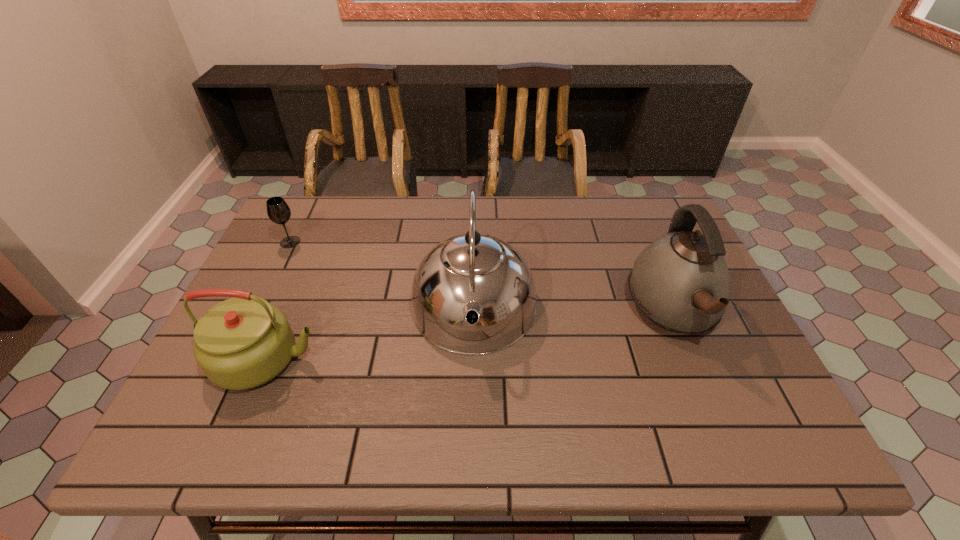
Find the location of a particular element. This screenshot has width=960, height=540. the third object from left to right is located at coordinates (473, 294).

This screenshot has height=540, width=960. In order to click on the rightmost kettle in this screenshot , I will do `click(681, 282)`.

Where is `the second tallest object`? This screenshot has height=540, width=960. the second tallest object is located at coordinates (681, 282).

I want to click on the shortest kettle, so click(x=241, y=343).

What are the coordinates of `the third tallest object` in the screenshot? It's located at (241, 343).

You are a GUI agent. You are given a task and a screenshot of the screen. Output one action in this format:
    pyautogui.click(x=<x>, y=<y>)
    Task: Click on the shortest object
    This screenshot has height=540, width=960.
    Given the screenshot: What is the action you would take?
    pyautogui.click(x=278, y=211)

You are a GUI agent. You are given a task and a screenshot of the screen. Output one action in this format:
    pyautogui.click(x=<x>, y=<y>)
    Task: Click on the wineglass
    This screenshot has width=960, height=540.
    Given the screenshot: What is the action you would take?
    pyautogui.click(x=278, y=211)

At what (x,y) coordinates should I click in order to perform the action: click on free space located 0.120m from the spout of the second object from right to left. Please return your answer as a coordinate pair (x, y). The width and height of the screenshot is (960, 540). Looking at the image, I should click on (472, 416).

Where is `free space located at the spout of the second shortest kettle`? free space located at the spout of the second shortest kettle is located at coordinates click(711, 401).

The image size is (960, 540). I want to click on vacant space located at the spout of the third tallest object, so click(495, 359).